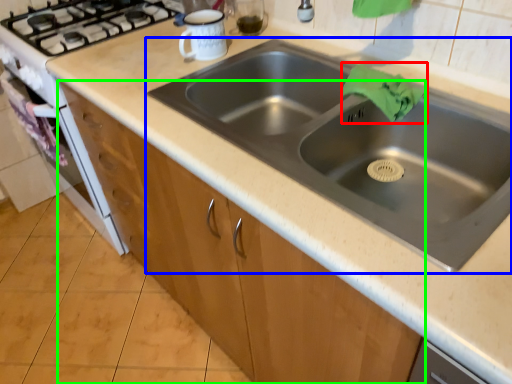
Question: Which object is positioned farthest from cloth (highlighted by a red box)? Select from sink (highlighted by a blue box) and cabinetry (highlighted by a green box).

Choices:
 (A) sink
 (B) cabinetry

Answer: (B)